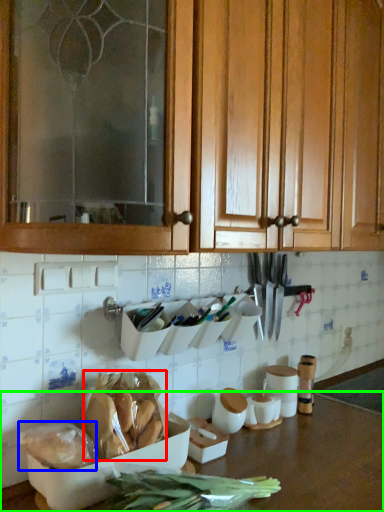
Question: Which object is positioned farthest from food (highlighted by a red box)? Select from food (highlighted by a blue box) and countertop (highlighted by a green box).

Choices:
 (A) food
 (B) countertop

Answer: (B)